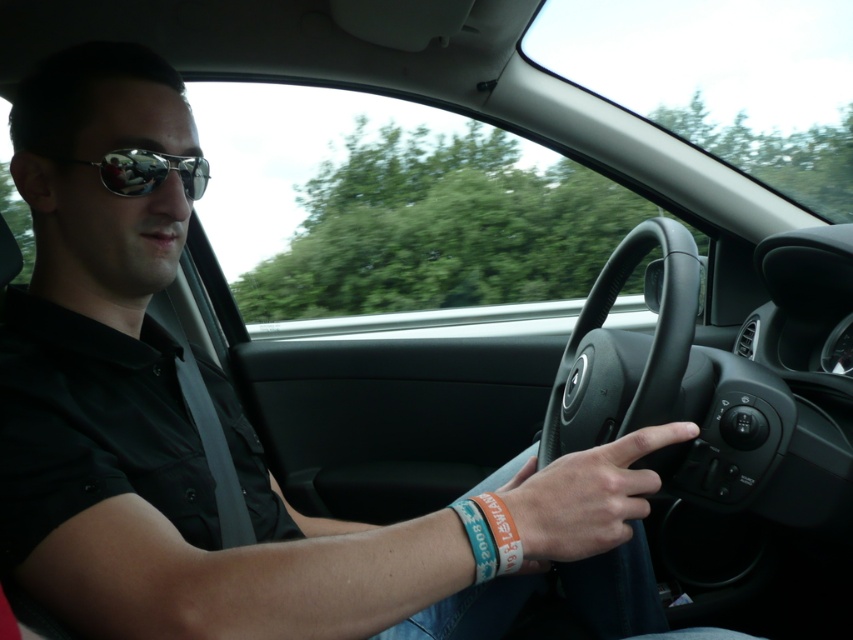
Question: Does black matte steering wheel at center appear over shiny reflective sunglasses at left?

Choices:
 (A) yes
 (B) no

Answer: (B)

Question: Which is nearer to the rubber band at lower center?

Choices:
 (A) shiny reflective sunglasses at left
 (B) teal fabric wristband at lower center
 (C) black matte steering wheel at center
 (D) smooth leather hand at center

Answer: (B)

Question: Which point is closer to the camera?

Choices:
 (A) shiny reflective sunglasses at left
 (B) rubber band at lower center

Answer: (B)

Question: Considering the real-world distances, which object is closest to the shiny reflective sunglasses at left?

Choices:
 (A) teal fabric wristband at lower center
 (B) black matte steering wheel at center
 (C) rubber band at lower center
 (D) smooth leather hand at center

Answer: (A)

Question: Is shiny reflective sunglasses at left positioned in front of teal fabric wristband at lower center?

Choices:
 (A) yes
 (B) no

Answer: (B)

Question: Does smooth leather hand at center appear on the right side of teal fabric wristband at lower center?

Choices:
 (A) yes
 (B) no

Answer: (A)